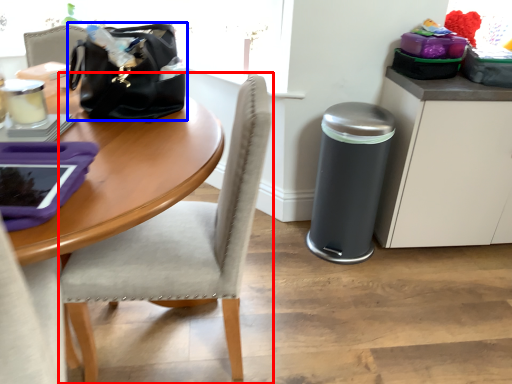
Question: Which object is closer to the camera taking this photo, chair (highlighted by a red box) or handbag (highlighted by a blue box)?

Choices:
 (A) chair
 (B) handbag

Answer: (A)